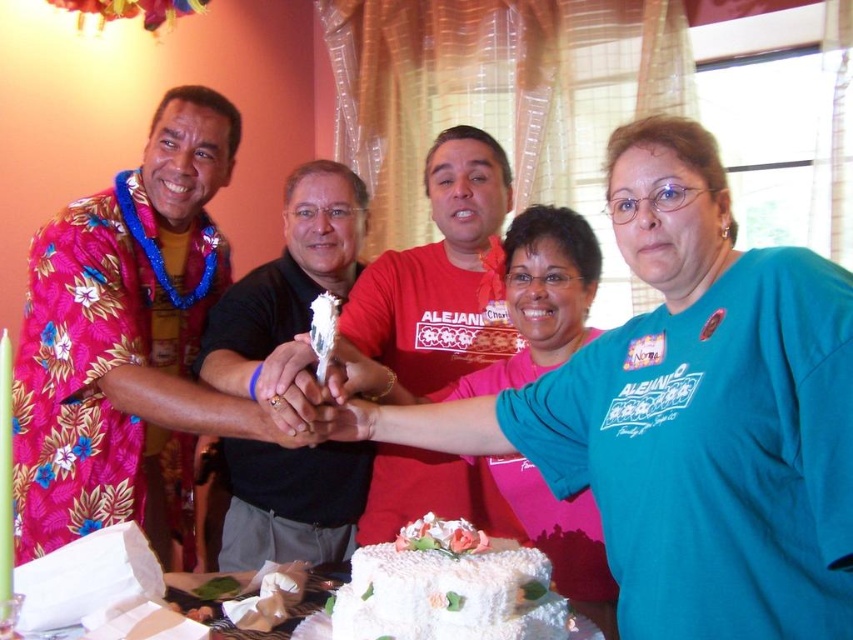
Question: In this image, where is floral print shirt at left located relative to white frosted cake at center?

Choices:
 (A) right
 (B) left

Answer: (B)

Question: Estimate the real-world distances between objects in this image. Which object is farther from the matte red shirt at center?

Choices:
 (A) white frosted cake at center
 (B) floral print shirt at left
 (C) black matte shirt at center

Answer: (A)

Question: Can you confirm if matte red shirt at center is positioned above white frosted cake at center?

Choices:
 (A) yes
 (B) no

Answer: (A)

Question: Does floral print shirt at left have a greater width compared to white frosted cake at center?

Choices:
 (A) no
 (B) yes

Answer: (B)

Question: Which point is closer to the camera?

Choices:
 (A) floral print shirt at left
 (B) white frosted cake at center
 (C) matte red shirt at center

Answer: (B)

Question: Which point is farther to the camera?

Choices:
 (A) (108, 412)
 (B) (262, 282)
 (C) (444, 340)
 (D) (347, 602)

Answer: (B)